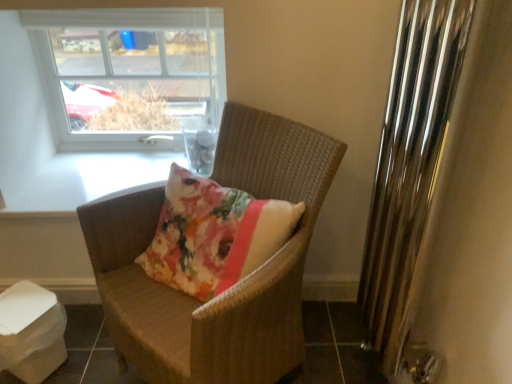
Question: Is clear glass window at upper left next to polished chrome radiator at right and touching it?

Choices:
 (A) yes
 (B) no

Answer: (B)

Question: Considering the relative sizes of clear glass window at upper left and polished chrome radiator at right in the image provided, is clear glass window at upper left bigger than polished chrome radiator at right?

Choices:
 (A) yes
 (B) no

Answer: (B)

Question: Can you confirm if clear glass window at upper left is shorter than polished chrome radiator at right?

Choices:
 (A) yes
 (B) no

Answer: (A)

Question: From a real-world perspective, is clear glass window at upper left below polished chrome radiator at right?

Choices:
 (A) no
 (B) yes

Answer: (A)

Question: From the image's perspective, is clear glass window at upper left on polished chrome radiator at right?

Choices:
 (A) yes
 (B) no

Answer: (A)

Question: Is clear glass window at upper left surrounding polished chrome radiator at right?

Choices:
 (A) yes
 (B) no

Answer: (B)

Question: Is polished chrome radiator at right in contact with woven brown chair at center?

Choices:
 (A) yes
 (B) no

Answer: (B)

Question: From the image's perspective, is polished chrome radiator at right located above woven brown chair at center?

Choices:
 (A) yes
 (B) no

Answer: (A)

Question: Does polished chrome radiator at right come in front of woven brown chair at center?

Choices:
 (A) no
 (B) yes

Answer: (B)

Question: Does polished chrome radiator at right have a larger size compared to woven brown chair at center?

Choices:
 (A) no
 (B) yes

Answer: (A)

Question: Does polished chrome radiator at right appear on the right side of woven brown chair at center?

Choices:
 (A) yes
 (B) no

Answer: (A)

Question: Could you tell me if polished chrome radiator at right is facing woven brown chair at center?

Choices:
 (A) yes
 (B) no

Answer: (A)

Question: From a real-world perspective, does woven brown chair at center stand above polished chrome radiator at right?

Choices:
 (A) no
 (B) yes

Answer: (A)